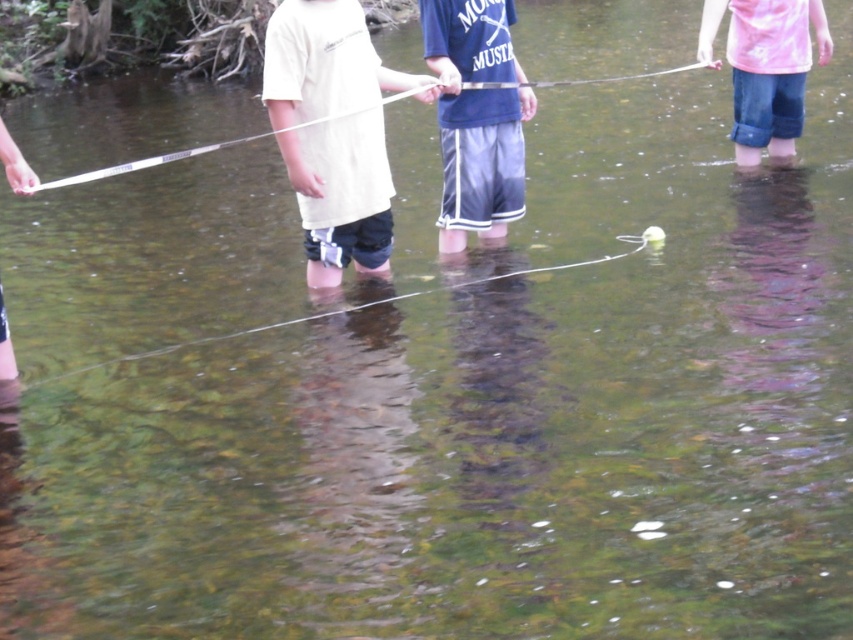
Which is in front, point (360, 32) or point (505, 179)?

Point (360, 32) is more forward.

Describe the element at coordinates (341, 195) in the screenshot. Image resolution: width=853 pixels, height=640 pixels. I see `white matte shirt at center` at that location.

Find the location of `white matte shirt at center`. white matte shirt at center is located at coordinates point(341,195).

Locate an element on the screen. This screenshot has height=640, width=853. white matte shirt at center is located at coordinates (341, 195).

Which is more to the left, white matte shirt at center or pink cotton shirt at upper right?

Positioned to the left is white matte shirt at center.

Is point (379, 236) behind point (799, 28)?

No, it is not.

This screenshot has width=853, height=640. I want to click on white matte shirt at center, so click(341, 195).

Is point (822, 49) in front of point (178, 152)?

No, it is behind (178, 152).

Does point (824, 61) come behind point (132, 166)?

Yes, point (824, 61) is behind point (132, 166).

What do you see at coordinates (764, 67) in the screenshot? I see `pink cotton shirt at upper right` at bounding box center [764, 67].

Image resolution: width=853 pixels, height=640 pixels. I want to click on pink cotton shirt at upper right, so 764,67.